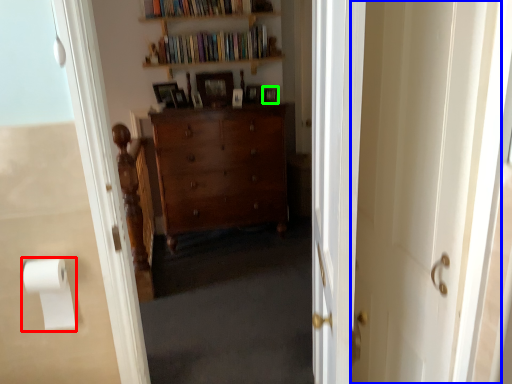
Question: Which is nearer to the toilet paper (highlighted by a red box)? screen door (highlighted by a blue box) or picture frame (highlighted by a green box).

Choices:
 (A) screen door
 (B) picture frame

Answer: (A)